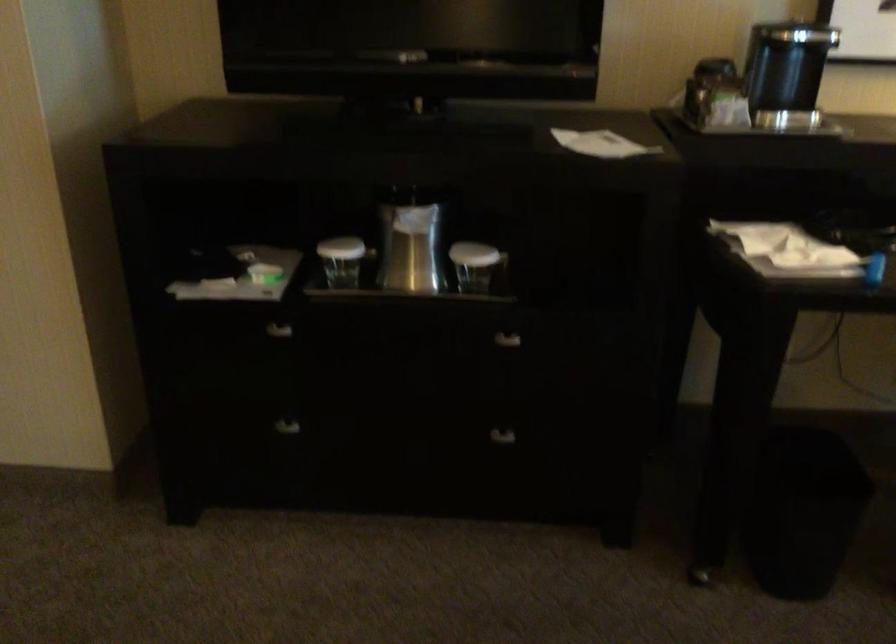
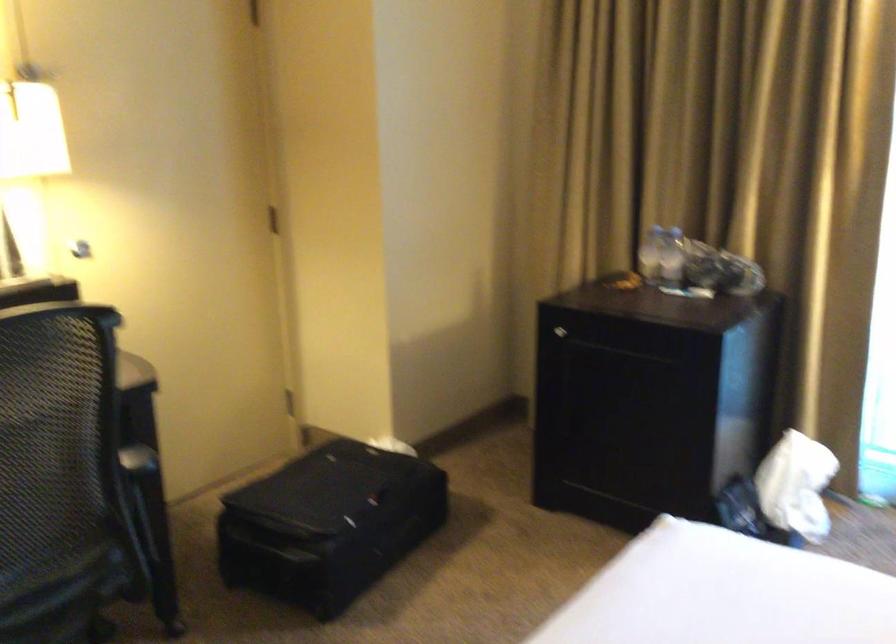
Question: The first image is from the beginning of the video and the second image is from the end. How did the camera likely rotate when shooting the video?

Choices:
 (A) Left
 (B) Right
 (C) Up
 (D) Down

Answer: (B)